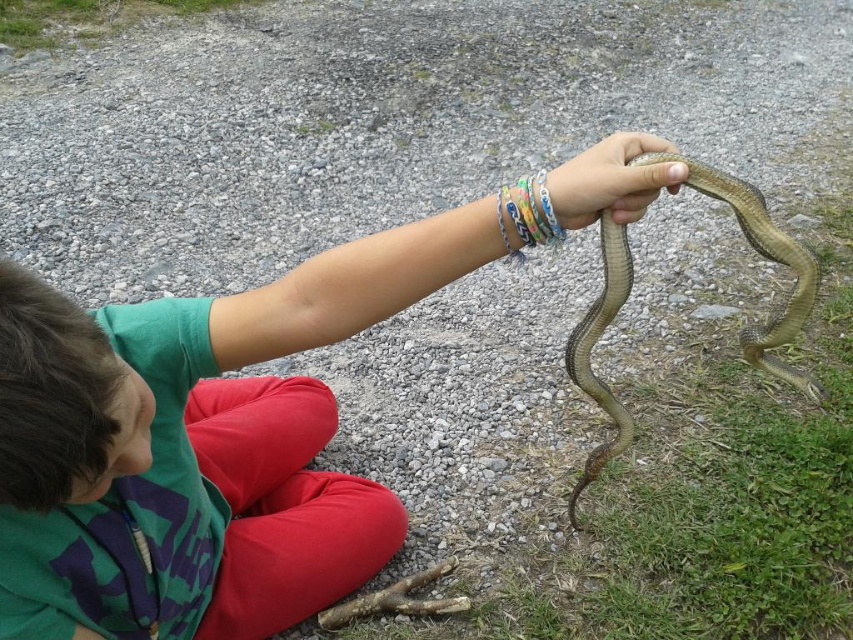
Is point (577, 332) positioned behind point (505, 236)?

Yes, it is behind point (505, 236).

I want to click on green scaly snake at right, so click(766, 259).

Is point (608, 416) positioned after point (527, 173)?

No, it is in front of (527, 173).

Where is `green scaly snake at right`? This screenshot has width=853, height=640. green scaly snake at right is located at coordinates (766, 259).

Who is lower down, green matte shirt at upper center or smooth skin hand at center?

green matte shirt at upper center

Identify the location of green matte shirt at upper center. (196, 445).

Who is more forward, (489, 259) or (579, 212)?

Positioned in front is point (579, 212).

Where is `green matte shirt at upper center`? This screenshot has width=853, height=640. green matte shirt at upper center is located at coordinates (196, 445).

Does green matte shirt at upper center have a larger size compared to multicolored plastic bracelets at center?

Correct, green matte shirt at upper center is larger in size than multicolored plastic bracelets at center.

Between green matte shirt at upper center and multicolored plastic bracelets at center, which one is positioned lower?

Positioned lower is green matte shirt at upper center.

Is point (305, 506) in front of point (502, 224)?

No.

Where is `green matte shirt at upper center`? green matte shirt at upper center is located at coordinates (196, 445).